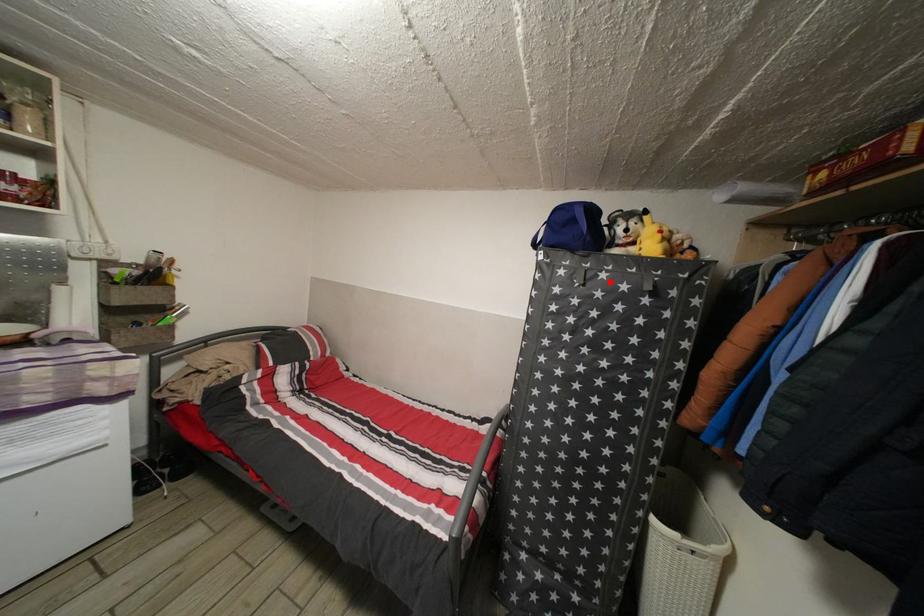
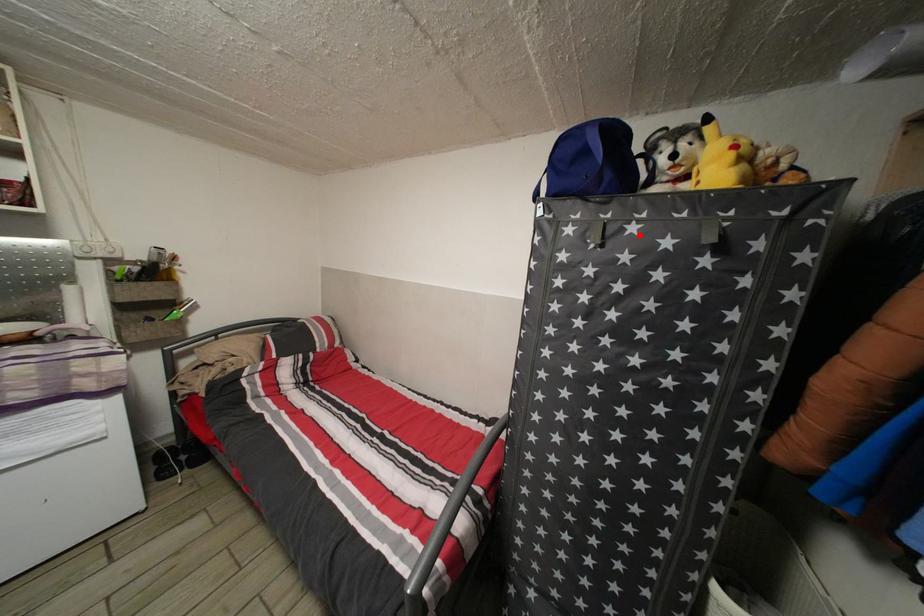
I am providing you with two images of the same scene from different viewpoints. A red point is marked on the first image and another point is marked on the second image. Does the point marked in image1 correspond to the same location as the one in image2?

Yes